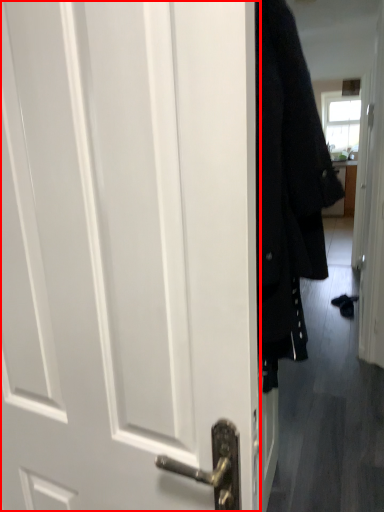
Question: From the image, what is the correct spatial relationship of door (annotated by the red box) in relation to coat?

Choices:
 (A) right
 (B) left

Answer: (B)